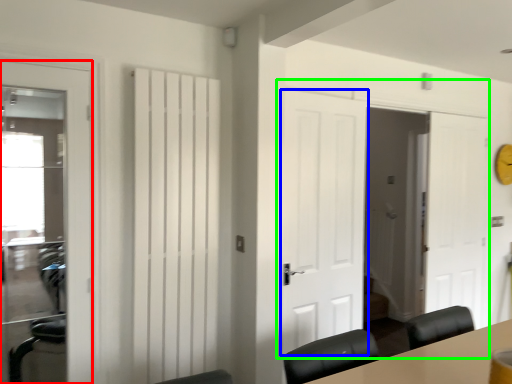
Question: Which object is positioned closest to door (highlighted by a red box)? Select from door (highlighted by a blue box) and door (highlighted by a green box).

Choices:
 (A) door
 (B) door

Answer: (A)